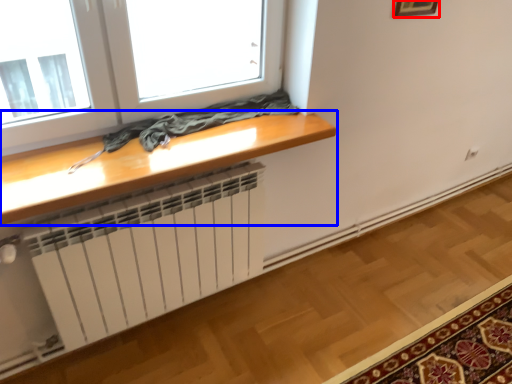
Question: Which of the following is the closest to the observer, picture frame (highlighted by a red box) or table (highlighted by a blue box)?

Choices:
 (A) picture frame
 (B) table

Answer: (B)